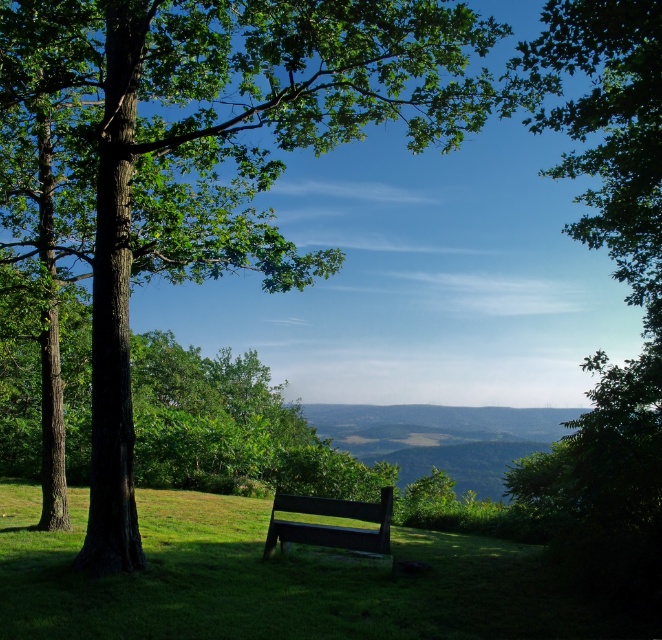
Question: Observing the image, what is the correct spatial positioning of green rough bark tree at center in reference to green matte bench at center?

Choices:
 (A) above
 (B) below

Answer: (A)

Question: Is green rough bark tree at center thinner than green matte bench at center?

Choices:
 (A) yes
 (B) no

Answer: (B)

Question: Which of the following is the closest to the observer?

Choices:
 (A) (307, 12)
 (B) (331, 545)

Answer: (A)

Question: Which point appears farthest from the camera in this image?

Choices:
 (A) (21, 54)
 (B) (289, 532)

Answer: (B)

Question: Which point is farther to the camera?

Choices:
 (A) green rough bark tree at center
 (B) green matte bench at center

Answer: (B)

Question: Is green rough bark tree at center wider than green matte bench at center?

Choices:
 (A) yes
 (B) no

Answer: (A)